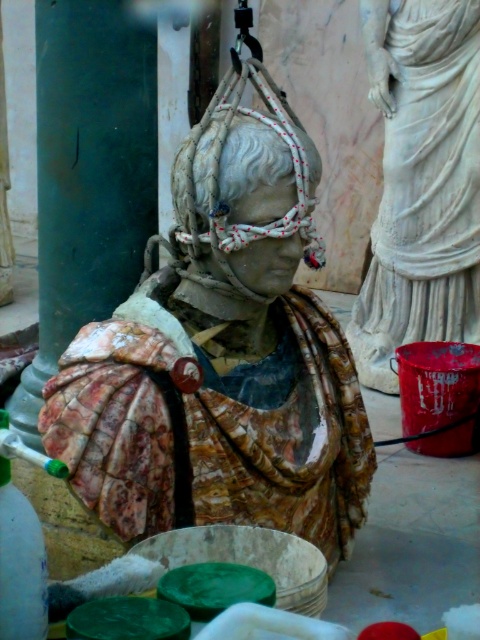
Question: Which object is closer to the camera taking this photo?

Choices:
 (A) white marble statue at upper right
 (B) marble bust at center

Answer: (B)

Question: Is marble bust at center to the right of white marble statue at upper right from the viewer's perspective?

Choices:
 (A) yes
 (B) no

Answer: (B)

Question: Which object appears closest to the camera in this image?

Choices:
 (A) white marble statue at upper right
 (B) marble bust at center

Answer: (B)

Question: Can you confirm if marble bust at center is positioned above white marble statue at upper right?

Choices:
 (A) yes
 (B) no

Answer: (B)

Question: Can you confirm if marble bust at center is positioned to the left of white marble statue at upper right?

Choices:
 (A) yes
 (B) no

Answer: (A)